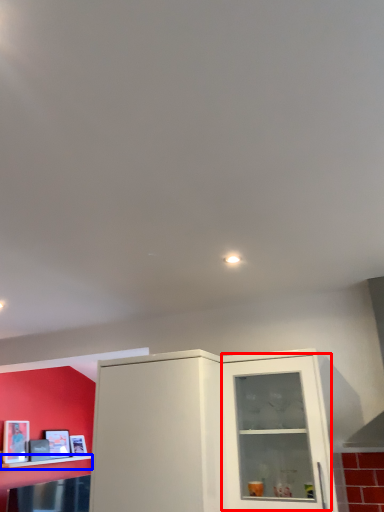
Question: Which object appears closest to the camera in this image, glass door (highlighted by a red box) or shelf (highlighted by a blue box)?

Choices:
 (A) glass door
 (B) shelf

Answer: (A)